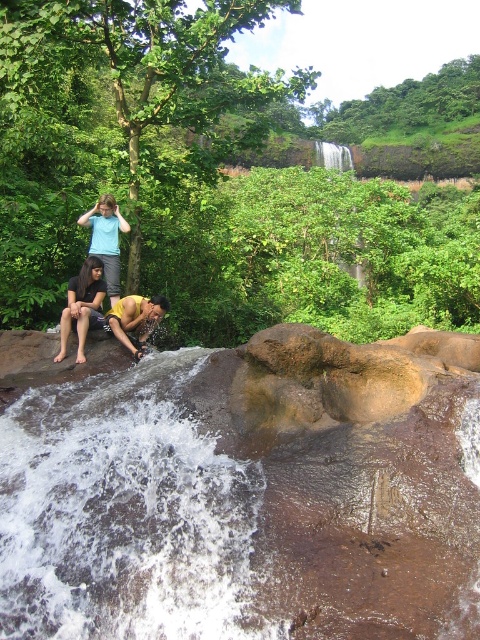
Who is shorter, dark brown hair at lower left or matte blue shirt at upper left?

With less height is dark brown hair at lower left.

Looking at this image, which of these two, dark brown hair at lower left or matte blue shirt at upper left, stands taller?

Standing taller between the two is matte blue shirt at upper left.

Who is more forward, (64, 339) or (80, 218)?

Positioned in front is point (64, 339).

Locate an element on the screen. This screenshot has height=640, width=480. dark brown hair at lower left is located at coordinates (82, 305).

Does white frothy water at center come behind matte blue shirt at upper left?

No, white frothy water at center is closer to the viewer.

From the picture: Is white frothy water at center thinner than matte blue shirt at upper left?

No, white frothy water at center is not thinner than matte blue shirt at upper left.

Is point (187, 614) positioned in front of point (97, 211)?

Yes, point (187, 614) is closer to viewer.

Find the location of a particular element. white frothy water at center is located at coordinates (244, 497).

Does point (93, 218) come in front of point (71, 276)?

Yes, it is.

Measure the distance between matte blue shirt at center and camera.

21.60 meters

At what (x,y) coordinates should I click in order to perform the action: click on matte blue shirt at center. Please return your answer as a coordinate pair (x, y). This screenshot has height=640, width=480. Looking at the image, I should click on (119, 276).